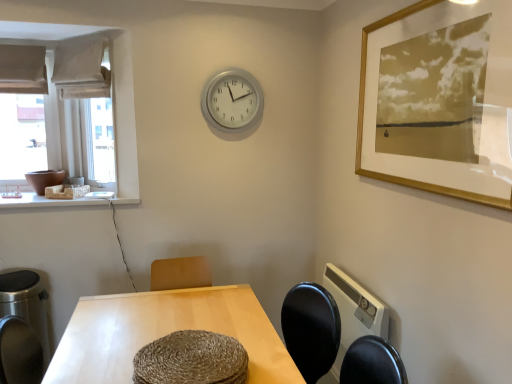
Looking at this image, measure the distance between point [98,87] and camera.

Point [98,87] and camera are 2.60 meters apart.

Describe the element at coordinates (231, 100) in the screenshot. Image resolution: width=512 pixels, height=384 pixels. I see `silver metallic clock at upper center` at that location.

Measure the distance between silver metallic clock at upper center and camera.

The distance of silver metallic clock at upper center from camera is 8.66 feet.

This screenshot has width=512, height=384. What do you see at coordinates (439, 100) in the screenshot? I see `gold framed print at upper right` at bounding box center [439, 100].

In the scene shown: Measure the distance between gold framed print at upper right and camera.

A distance of 1.28 meters exists between gold framed print at upper right and camera.

The image size is (512, 384). Describe the element at coordinates (47, 201) in the screenshot. I see `white stone at left` at that location.

Identify the location of white fabric curtain at upper left. Image resolution: width=512 pixels, height=384 pixels. (x=81, y=70).

Is gold framed print at upper right surrounded by light wood table at center?

No.

From a real-world perspective, which object rests below the other?

From a 3D spatial view, light wood table at center is below.

Is the surface of light wood table at center in direct contact with gold framed print at upper right?

light wood table at center and gold framed print at upper right are clearly separated.

Is light wood table at center bigger than gold framed print at upper right?

Correct, light wood table at center is larger in size than gold framed print at upper right.

In terms of width, does silver metallic clock at upper center look wider or thinner when compared to light wood table at center?

In the image, silver metallic clock at upper center appears to be more narrow than light wood table at center.

Is silver metallic clock at upper center taller than light wood table at center?

No, silver metallic clock at upper center is not taller than light wood table at center.

Is silver metallic clock at upper center next to light wood table at center and touching it?

silver metallic clock at upper center is not next to light wood table at center, and they're not touching.

Is silver metallic clock at upper center at the back of white stone at left?

white stone at left does not have its back to silver metallic clock at upper center.

In the scene shown: Are white stone at left and silver metallic clock at upper center beside each other?

white stone at left and silver metallic clock at upper center are clearly separated.

From a real-world perspective, is white stone at left above or below silver metallic clock at upper center?

Clearly, from a real-world perspective, white stone at left is below silver metallic clock at upper center.

Considering the points (35, 196) and (237, 111), which point is in front, point (35, 196) or point (237, 111)?

The point (35, 196) is closer.

Is the position of white stone at left less distant than that of white fabric curtain at upper left?

Yes, white stone at left is closer to the camera.

What's the angular difference between white stone at left and white fabric curtain at upper left's facing directions?

The angle between the facing direction of white stone at left and the facing direction of white fabric curtain at upper left is 46 degrees.

Where is `curtain above the white stone at left (from the image's perspective)`? curtain above the white stone at left (from the image's perspective) is located at coordinates (81, 70).

Considering the positions of points (99, 201) and (82, 59), is point (99, 201) closer to camera compared to point (82, 59)?

That is True.

Is light wood table at center inside white stone at left?

Actually, light wood table at center is outside white stone at left.

Does white stone at left turn towards light wood table at center?

No.

Consider the image. Does white stone at left come behind light wood table at center?

→ Yes, white stone at left is behind light wood table at center.

Is there a large distance between white fabric curtain at upper left and gold framed print at upper right?

Yes, white fabric curtain at upper left and gold framed print at upper right are located far from each other.

From a real-world perspective, which is physically above, white fabric curtain at upper left or gold framed print at upper right?

white fabric curtain at upper left is physically above.

Is white fabric curtain at upper left oriented away from gold framed print at upper right?

That's not correct — white fabric curtain at upper left is not looking away from gold framed print at upper right.

Where is `curtain that is above the gold framed print at upper right (from the image's perspective)`? The width and height of the screenshot is (512, 384). curtain that is above the gold framed print at upper right (from the image's perspective) is located at coordinates (81, 70).

Can you tell me how much light wood table at center and silver metallic clock at upper center differ in facing direction?

90.8 degrees.

Can you confirm if light wood table at center is positioned to the left of silver metallic clock at upper center?

Indeed, light wood table at center is positioned on the left side of silver metallic clock at upper center.

In terms of width, does light wood table at center look wider or thinner when compared to silver metallic clock at upper center?

light wood table at center is wider than silver metallic clock at upper center.

Can you see light wood table at center touching silver metallic clock at upper center?

No, light wood table at center is not making contact with silver metallic clock at upper center.

Identify the location of table below the gold framed print at upper right (from the image's perspective). Image resolution: width=512 pixels, height=384 pixels. (165, 333).

Locate an element on the screen. This screenshot has height=384, width=512. wall clock that appears above the light wood table at center (from a real-world perspective) is located at coordinates (231, 100).

Which object lies further to the anchor point gold framed print at upper right, white fabric curtain at upper left or light wood table at center?

white fabric curtain at upper left is further to gold framed print at upper right.

Which object lies further to the anchor point gold framed print at upper right, white stone at left or silver metallic clock at upper center?

The object further to gold framed print at upper right is white stone at left.

Based on their spatial positions, is white fabric curtain at upper left or light wood table at center closer to silver metallic clock at upper center?

white fabric curtain at upper left.

Estimate the real-world distances between objects in this image. Which object is further from silver metallic clock at upper center, light wood table at center or white stone at left?

The object further to silver metallic clock at upper center is light wood table at center.

Looking at the image, which one is located closer to light wood table at center, white stone at left or gold framed print at upper right?

Based on the image, white stone at left appears to be nearer to light wood table at center.

Looking at this image, considering their positions, is white fabric curtain at upper left positioned closer to white stone at left than silver metallic clock at upper center?

white fabric curtain at upper left is closer to white stone at left.

Considering their positions, is white fabric curtain at upper left positioned further to gold framed print at upper right than white stone at left?

white fabric curtain at upper left is further to gold framed print at upper right.

Based on their spatial positions, is gold framed print at upper right or white fabric curtain at upper left further from silver metallic clock at upper center?

The object further to silver metallic clock at upper center is gold framed print at upper right.

Identify the location of table between white stone at left and gold framed print at upper right in the horizontal direction. (165, 333).

Locate an element on the screen. Image resolution: width=512 pixels, height=384 pixels. window sill positioned between light wood table at center and silver metallic clock at upper center from near to far is located at coordinates (47, 201).

Find the location of a particular element. Image resolution: width=512 pixels, height=384 pixels. curtain between white stone at left and silver metallic clock at upper center from left to right is located at coordinates (81, 70).

The width and height of the screenshot is (512, 384). I want to click on window sill that lies between white fabric curtain at upper left and light wood table at center from top to bottom, so [47, 201].